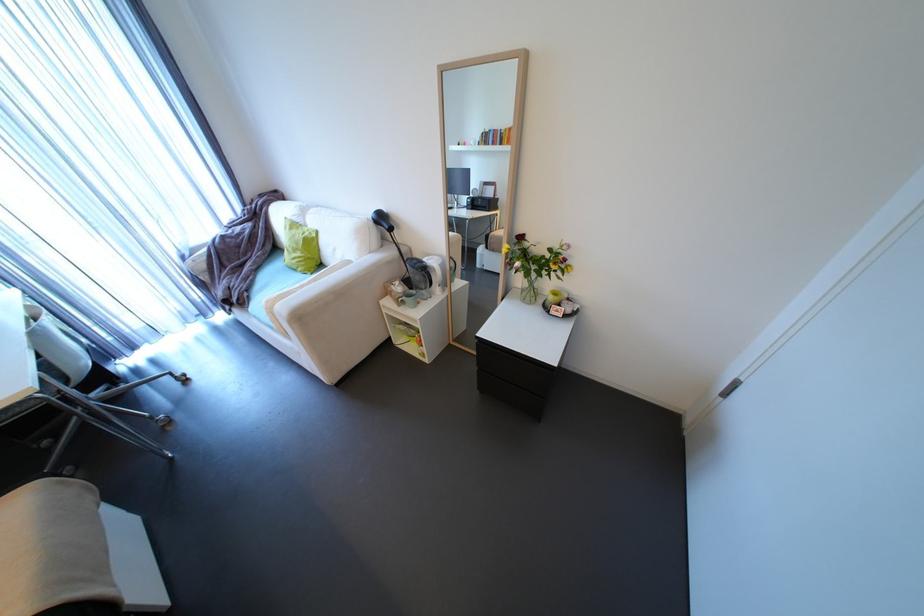
The image size is (924, 616). What do you see at coordinates (32, 392) in the screenshot? I see `the chair sitting surface` at bounding box center [32, 392].